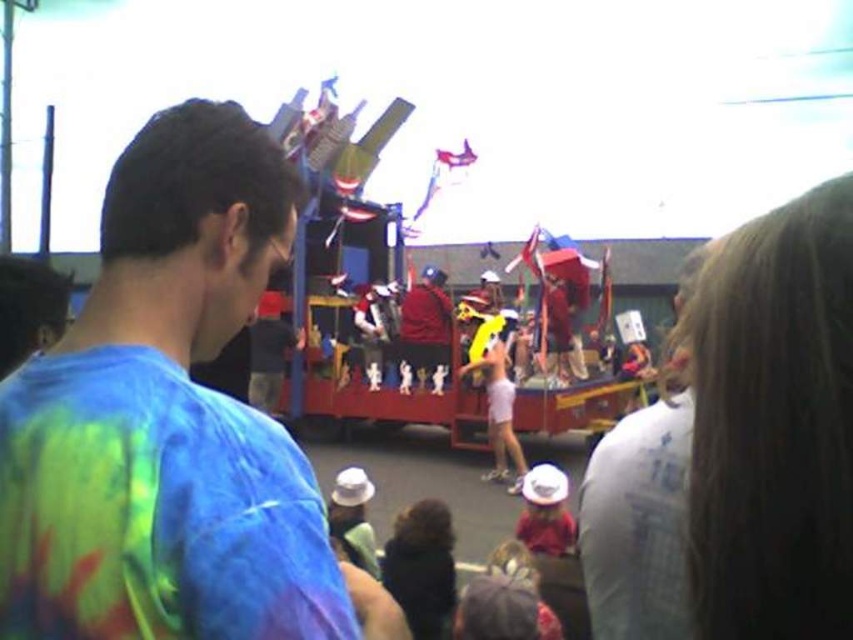
This screenshot has height=640, width=853. Identify the location of tie-dye fabric shirt at center. (166, 419).

Is tie-dye fabric shirt at center to the right of white cotton shirt at upper right from the viewer's perspective?

Incorrect, tie-dye fabric shirt at center is not on the right side of white cotton shirt at upper right.

Image resolution: width=853 pixels, height=640 pixels. In order to click on tie-dye fabric shirt at center in this screenshot , I will do `click(166, 419)`.